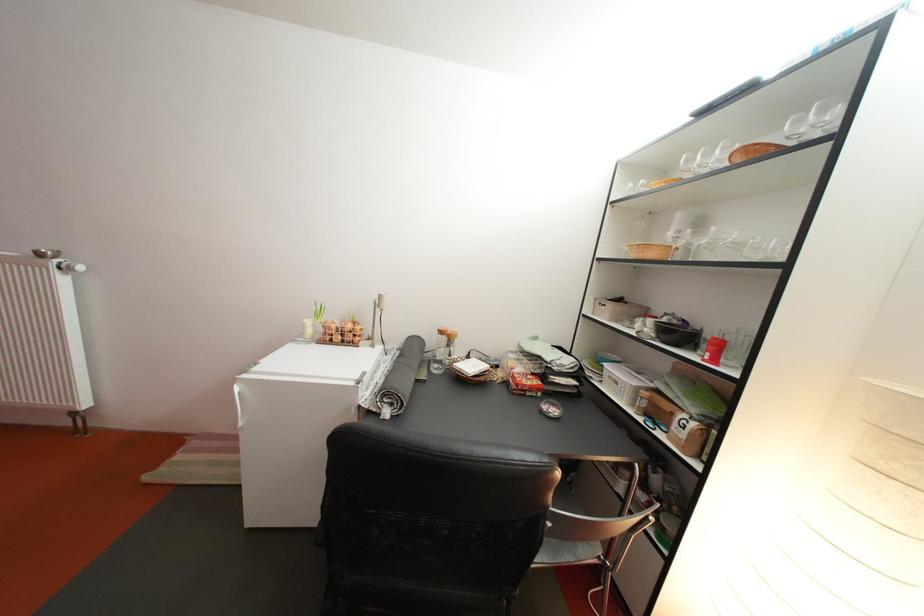
Identify the location of white candle. (381, 301).